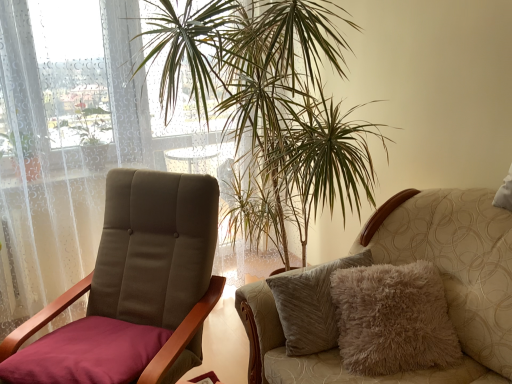
Measure the distance between point (321, 41) and camera.

5.48 feet.

Locate an element on the screen. The image size is (512, 384). fuzzy beige cushion at right, the second chair from the left is located at coordinates pyautogui.click(x=407, y=262).

Between green leafy plant at center and velvet maroon chair at left, the 2th chair viewed from the right, which one has more height?

green leafy plant at center is taller.

Is green leafy plant at center with velvet maroon chair at left, which appears as the first chair when viewed from the left?

green leafy plant at center and velvet maroon chair at left, which appears as the first chair when viewed from the left, are not in contact.

From the image's perspective, is green leafy plant at center located above or below velvet maroon chair at left, the 2th chair viewed from the right?

Based on their image positions, green leafy plant at center is located above velvet maroon chair at left, the 2th chair viewed from the right.

Find the location of `houseplant above the velvet maroon chair at left, the 2th chair viewed from the right (from a real-world perspective)`. houseplant above the velvet maroon chair at left, the 2th chair viewed from the right (from a real-world perspective) is located at coordinates (270, 92).

Is green leafy plant at center further to camera compared to fuzzy beige cushion at right, the second chair from the left?

Yes, green leafy plant at center is further from the viewer.

Where is `houseplant above the fuzzy beige cushion at right, which appears as the 1th chair when viewed from the right (from the image's perspective)`? This screenshot has height=384, width=512. houseplant above the fuzzy beige cushion at right, which appears as the 1th chair when viewed from the right (from the image's perspective) is located at coordinates (270, 92).

In terms of size, does green leafy plant at center appear bigger or smaller than fuzzy beige cushion at right, the second chair from the left?

green leafy plant at center is bigger than fuzzy beige cushion at right, the second chair from the left.

Does fuzzy beige cushion at right, the second chair from the left, have a lesser height compared to green leafy plant at center?

Indeed, fuzzy beige cushion at right, the second chair from the left, has a lesser height compared to green leafy plant at center.

In the scene shown: From a real-world perspective, relative to green leafy plant at center, is fuzzy beige cushion at right, which appears as the 1th chair when viewed from the right, vertically above or below?

fuzzy beige cushion at right, which appears as the 1th chair when viewed from the right, is below green leafy plant at center.

Can you tell me how much fuzzy beige cushion at right, the second chair from the left, and green leafy plant at center differ in facing direction?

1.32 degrees.

Considering the sizes of objects velvet maroon chair at left, which appears as the first chair when viewed from the left, and fuzzy beige cushion at right, the second chair from the left, in the image provided, who is thinner, velvet maroon chair at left, which appears as the first chair when viewed from the left, or fuzzy beige cushion at right, the second chair from the left,?

With smaller width is velvet maroon chair at left, which appears as the first chair when viewed from the left.

From the image's perspective, would you say velvet maroon chair at left, which appears as the first chair when viewed from the left, is positioned over fuzzy beige cushion at right, which appears as the 1th chair when viewed from the right?

Yes, from the image's perspective, velvet maroon chair at left, which appears as the first chair when viewed from the left, is above fuzzy beige cushion at right, which appears as the 1th chair when viewed from the right.

Is velvet maroon chair at left, the 2th chair viewed from the right, facing away from fuzzy beige cushion at right, the second chair from the left?

No, velvet maroon chair at left, the 2th chair viewed from the right,'s orientation is not away from fuzzy beige cushion at right, the second chair from the left.

Is velvet maroon chair at left, the 2th chair viewed from the right, not inside fuzzy beige cushion at right, the second chair from the left?

Yes, velvet maroon chair at left, the 2th chair viewed from the right, is located beyond the bounds of fuzzy beige cushion at right, the second chair from the left.

Could you tell me if fuzzy beige cushion at right, which appears as the 1th chair when viewed from the right, is turned towards velvet maroon chair at left, the 2th chair viewed from the right?

Yes.

Is fuzzy beige cushion at right, the second chair from the left, to the left of velvet maroon chair at left, which appears as the first chair when viewed from the left, from the viewer's perspective?

No.

Between fuzzy beige cushion at right, which appears as the 1th chair when viewed from the right, and velvet maroon chair at left, the 2th chair viewed from the right, which one is positioned behind?

velvet maroon chair at left, the 2th chair viewed from the right, is more distant.

Would you say fuzzy beige cushion at right, the second chair from the left, is a long distance from velvet maroon chair at left, which appears as the first chair when viewed from the left?

That's not correct — fuzzy beige cushion at right, the second chair from the left, is a little close to velvet maroon chair at left, which appears as the first chair when viewed from the left.

Based on the photo, is velvet maroon chair at left, the 2th chair viewed from the right, next to green leafy plant at center?

No, velvet maroon chair at left, the 2th chair viewed from the right, is not with green leafy plant at center.

Which object is further away from the camera taking this photo, velvet maroon chair at left, the 2th chair viewed from the right, or green leafy plant at center?

green leafy plant at center is behind.

The width and height of the screenshot is (512, 384). Find the location of `houseplant behind the velvet maroon chair at left, the 2th chair viewed from the right`. houseplant behind the velvet maroon chair at left, the 2th chair viewed from the right is located at coordinates (270, 92).

Who is taller, velvet maroon chair at left, the 2th chair viewed from the right, or green leafy plant at center?

Standing taller between the two is green leafy plant at center.

Find the location of `the 1st chair in front of the green leafy plant at center, counting from the anchor's position`. the 1st chair in front of the green leafy plant at center, counting from the anchor's position is located at coordinates (135, 288).

Where is `houseplant above the fuzzy beige cushion at right, the second chair from the left (from the image's perspective)`? houseplant above the fuzzy beige cushion at right, the second chair from the left (from the image's perspective) is located at coordinates (270, 92).

Considering their positions, is fuzzy beige cushion at right, the second chair from the left, positioned further to velvet maroon chair at left, the 2th chair viewed from the right, than green leafy plant at center?

green leafy plant at center lies further to velvet maroon chair at left, the 2th chair viewed from the right, than the other object.

When comparing their distances from fuzzy beige cushion at right, the second chair from the left, does green leafy plant at center or velvet maroon chair at left, which appears as the first chair when viewed from the left, seem further?

green leafy plant at center is positioned further to the anchor fuzzy beige cushion at right, the second chair from the left.

Which object lies nearer to the anchor point green leafy plant at center, velvet maroon chair at left, which appears as the first chair when viewed from the left, or fuzzy beige cushion at right, the second chair from the left?

Based on the image, velvet maroon chair at left, which appears as the first chair when viewed from the left, appears to be nearer to green leafy plant at center.

Considering their positions, is velvet maroon chair at left, the 2th chair viewed from the right, positioned further to fuzzy beige cushion at right, the second chair from the left, than green leafy plant at center?

green leafy plant at center is positioned further to the anchor fuzzy beige cushion at right, the second chair from the left.

Which object lies nearer to the anchor point green leafy plant at center, fuzzy beige cushion at right, the second chair from the left, or velvet maroon chair at left, which appears as the first chair when viewed from the left?

Among the two, velvet maroon chair at left, which appears as the first chair when viewed from the left, is located nearer to green leafy plant at center.

Estimate the real-world distances between objects in this image. Which object is closer to velvet maroon chair at left, which appears as the first chair when viewed from the left, green leafy plant at center or fuzzy beige cushion at right, the second chair from the left?

fuzzy beige cushion at right, the second chair from the left.

Locate an element on the screen. houseplant between velvet maroon chair at left, which appears as the first chair when viewed from the left, and fuzzy beige cushion at right, the second chair from the left, in the horizontal direction is located at coordinates (270, 92).